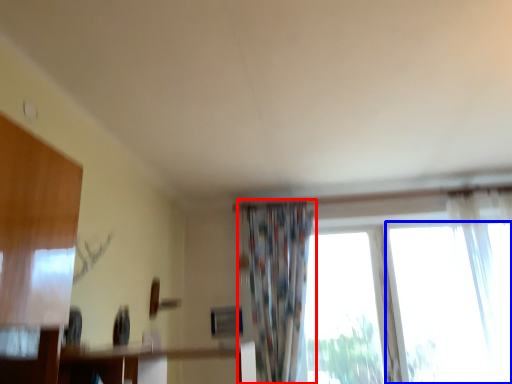
Question: Which point is closer to the camera, curtain (highlighted by a red box) or window (highlighted by a blue box)?

Choices:
 (A) curtain
 (B) window

Answer: (A)